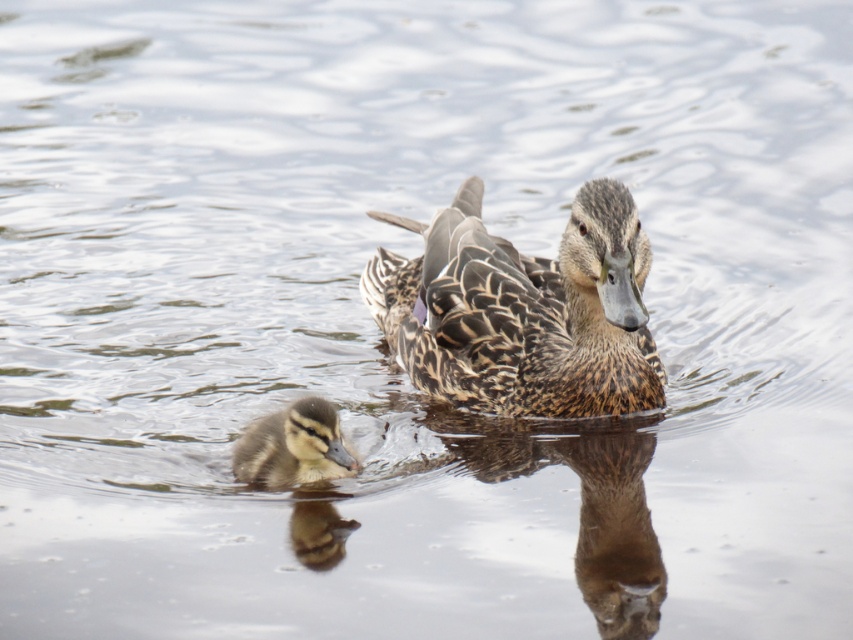
You are a birdwatcher observing two ducks on the water. You notice a point at coordinates (523, 310). Which duck does this point correspond to? The adult duck or the duckling?

The point at coordinates (523, 310) corresponds to the speckled feathered duckling at center, so it is the duckling.

You are a photographer trying to capture a closeup of both the speckled feathered duckling at center and the brown fuzzy duckling at lower left. Since you want both in focus, you need to know which duckling is closer to the camera. Based on the scene, can you determine which duckling is closer?

The speckled feathered duckling at center is larger in size than the brown fuzzy duckling at lower left, which suggests it is closer to the camera since objects closer appear larger.

You are a photographer trying to capture a clear shot of both the speckled feathered duckling at center and the brown fuzzy duckling at lower left. Based on their positions, which duckling is blocking the view of the other?

The brown fuzzy duckling at lower left is behind the speckled feathered duckling at center, so the speckled feathered duckling at center is blocking the view of the brown fuzzy duckling at lower left.